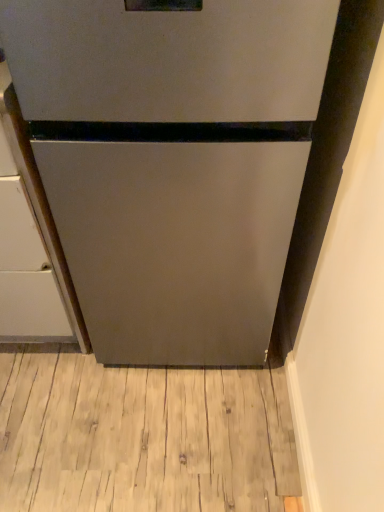
Question: Is light brown wood flooring at lower center to the left or to the right of satin silver refrigerator at center in the image?

Choices:
 (A) right
 (B) left

Answer: (B)

Question: Is light brown wood flooring at lower center inside or outside of satin silver refrigerator at center?

Choices:
 (A) outside
 (B) inside

Answer: (A)

Question: Considering the real-world distances, which object is farthest from the satin silver cabinet at left?

Choices:
 (A) light brown wood flooring at lower center
 (B) satin silver refrigerator at center

Answer: (A)

Question: Which object is positioned closest to the satin silver refrigerator at center?

Choices:
 (A) satin silver cabinet at left
 (B) light brown wood flooring at lower center

Answer: (A)